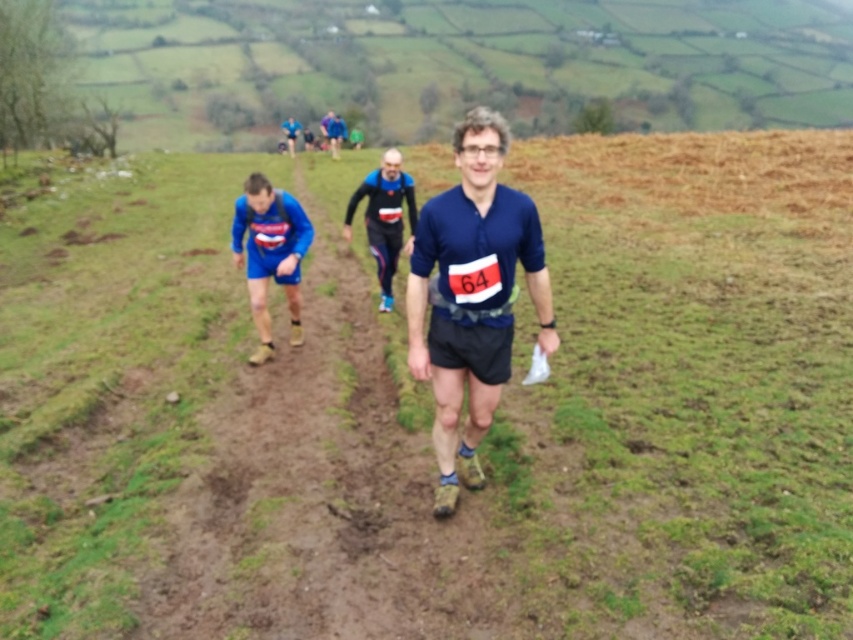
Question: Does blue fabric shirt at center appear over blue fabric running suit at center?

Choices:
 (A) yes
 (B) no

Answer: (B)

Question: Can you confirm if blue fabric running suit at center is positioned above blue fabric runner at upper center?

Choices:
 (A) no
 (B) yes

Answer: (A)

Question: Which point is farther to the camera?

Choices:
 (A) (259, 321)
 (B) (294, 129)

Answer: (B)

Question: Which point is closer to the camera?

Choices:
 (A) matte blue shorts at center
 (B) blue fabric running suit at center
 (C) blue fabric shirt at center
 (D) brown dirt track at center

Answer: (D)

Question: Is blue fabric shirt at center positioned before matte blue shorts at center?

Choices:
 (A) yes
 (B) no

Answer: (A)

Question: Which point appears closest to the camera in this image?

Choices:
 (A) (288, 145)
 (B) (372, 196)
 (C) (241, 620)
 (D) (286, 260)

Answer: (C)